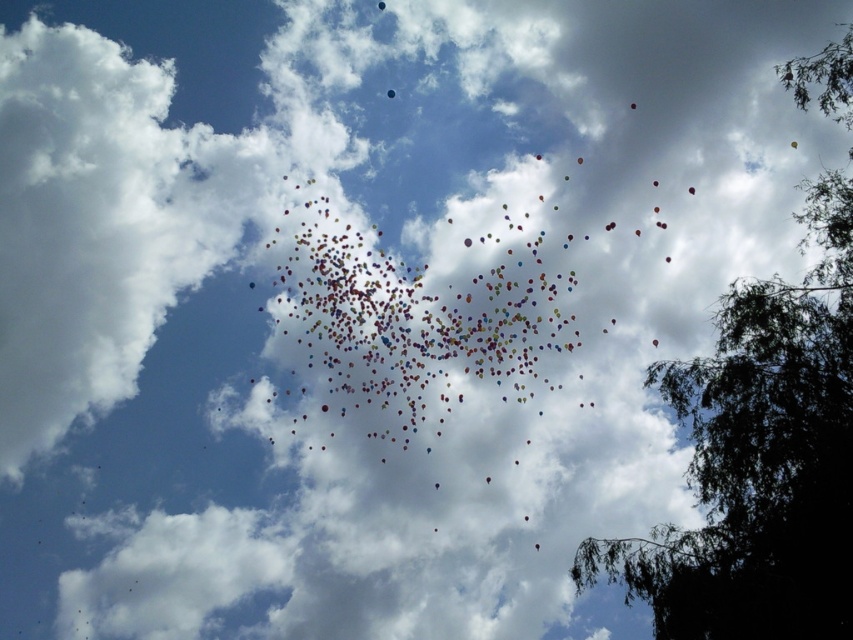
Question: Which object is farther from the camera taking this photo?

Choices:
 (A) green leafy tree at upper right
 (B) translucent glossy balloon at upper center

Answer: (B)

Question: Among these points, which one is farthest from the camera?

Choices:
 (A) (851, 296)
 (B) (389, 90)

Answer: (B)

Question: Is green leafy tree at upper right thinner than translucent glossy balloon at upper center?

Choices:
 (A) yes
 (B) no

Answer: (B)

Question: Which object is closer to the camera taking this photo?

Choices:
 (A) translucent glossy balloon at upper center
 (B) green leafy tree at upper right

Answer: (B)

Question: Does green leafy tree at upper right have a greater width compared to translucent glossy balloon at upper center?

Choices:
 (A) yes
 (B) no

Answer: (A)

Question: Is green leafy tree at upper right wider than translucent glossy balloon at upper center?

Choices:
 (A) yes
 (B) no

Answer: (A)